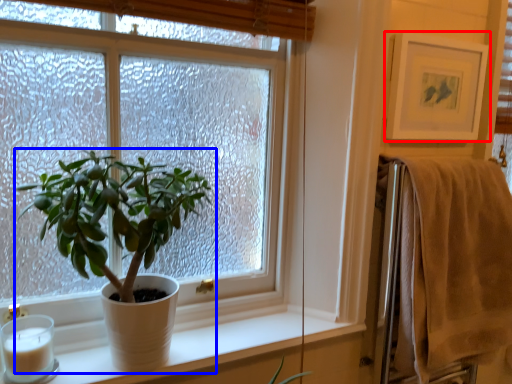
Question: Which of the following is the farthest to the observer, picture frame (highlighted by a red box) or houseplant (highlighted by a blue box)?

Choices:
 (A) picture frame
 (B) houseplant

Answer: (A)